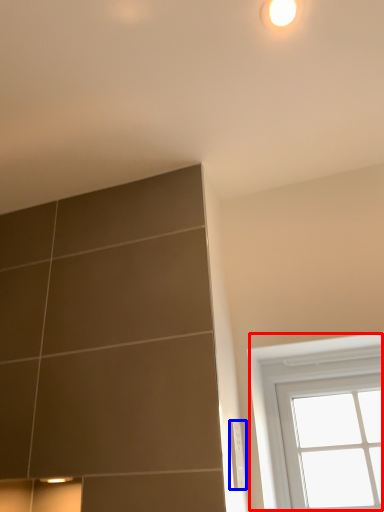
Question: Among these objects, which one is farthest to the camera, window (highlighted by a red box) or electric outlet (highlighted by a blue box)?

Choices:
 (A) window
 (B) electric outlet

Answer: (A)